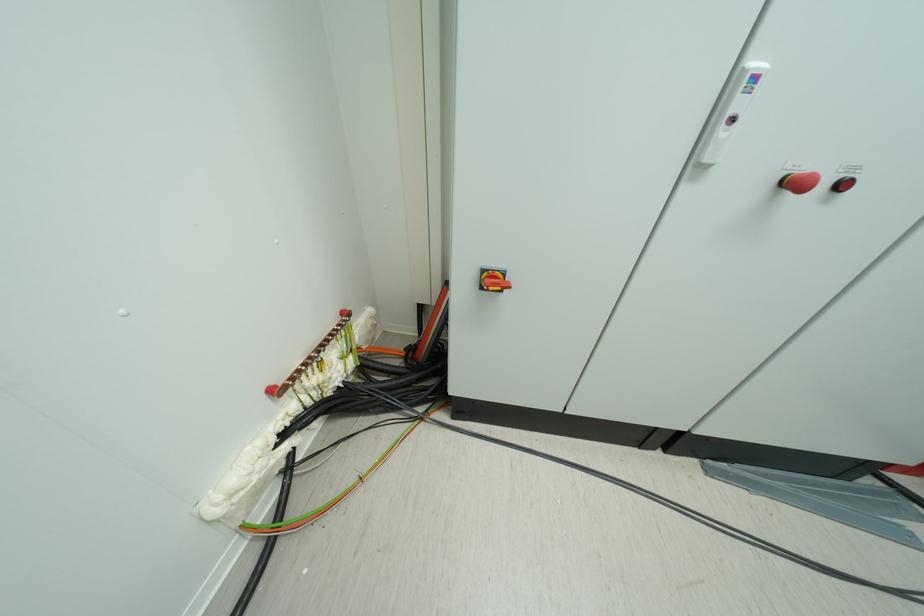
This screenshot has width=924, height=616. Describe the element at coordinates (843, 184) in the screenshot. I see `the red emergency button` at that location.